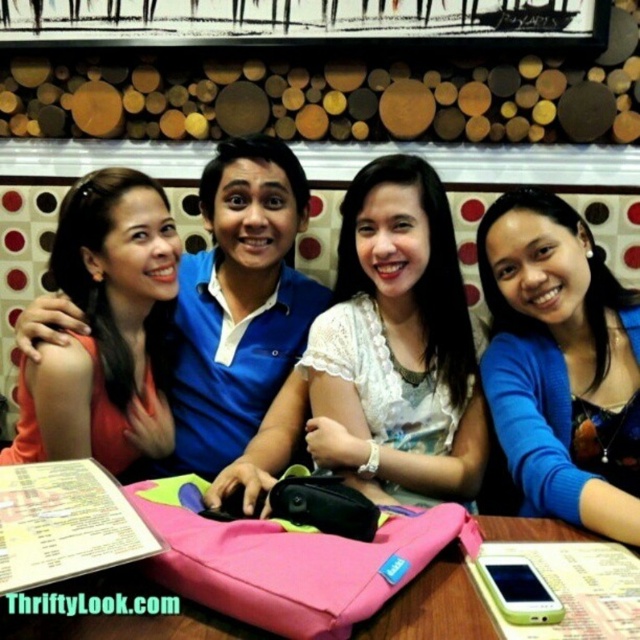
Does matte orange shirt at left have a greater width compared to pink fabric table at center?

Incorrect, matte orange shirt at left's width does not surpass pink fabric table at center's.

Is matte orange shirt at left to the left of pink fabric table at center from the viewer's perspective?

Yes, matte orange shirt at left is to the left of pink fabric table at center.

Which is behind, point (93, 352) or point (259, 561)?

The point (93, 352) is more distant.

Identify the location of matte orange shirt at left. The image size is (640, 640). (106, 328).

Can you confirm if blue matte sweater at center is positioned to the left of pink fabric table at center?

Incorrect, blue matte sweater at center is not on the left side of pink fabric table at center.

Which is in front, point (595, 273) or point (125, 490)?

Point (125, 490)

Find the location of a particular element. The width and height of the screenshot is (640, 640). blue matte sweater at center is located at coordinates (561, 364).

Does white lace blouse at center have a greater width compared to matte orange shirt at left?

Correct, the width of white lace blouse at center exceeds that of matte orange shirt at left.

Can you confirm if white lace blouse at center is taller than matte orange shirt at left?

Correct, white lace blouse at center is much taller as matte orange shirt at left.

Is point (454, 387) positioned after point (116, 470)?

No, (454, 387) is closer to viewer.

In order to click on white lace blouse at center in this screenshot , I will do `click(381, 352)`.